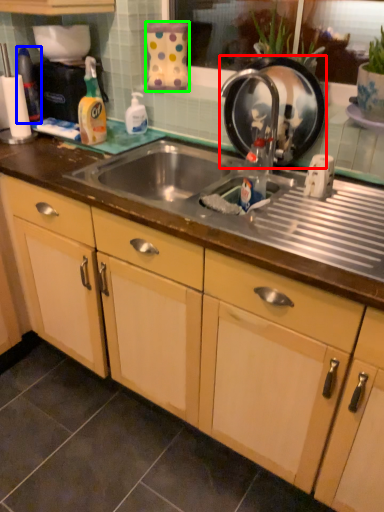
Question: Based on their relative distances, which object is farther from appliance (highlighted by a red box)? Choose from bottle (highlighted by a blue box) and appliance (highlighted by a green box).

Choices:
 (A) bottle
 (B) appliance

Answer: (A)